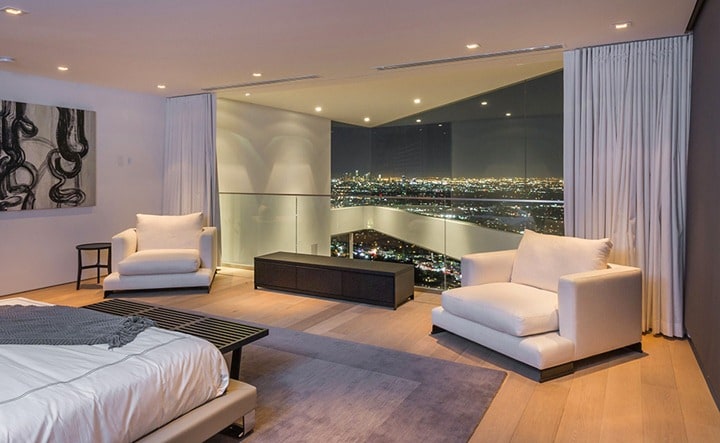
Find the location of a particular element. This screenshot has height=443, width=720. wall is located at coordinates (29, 217).